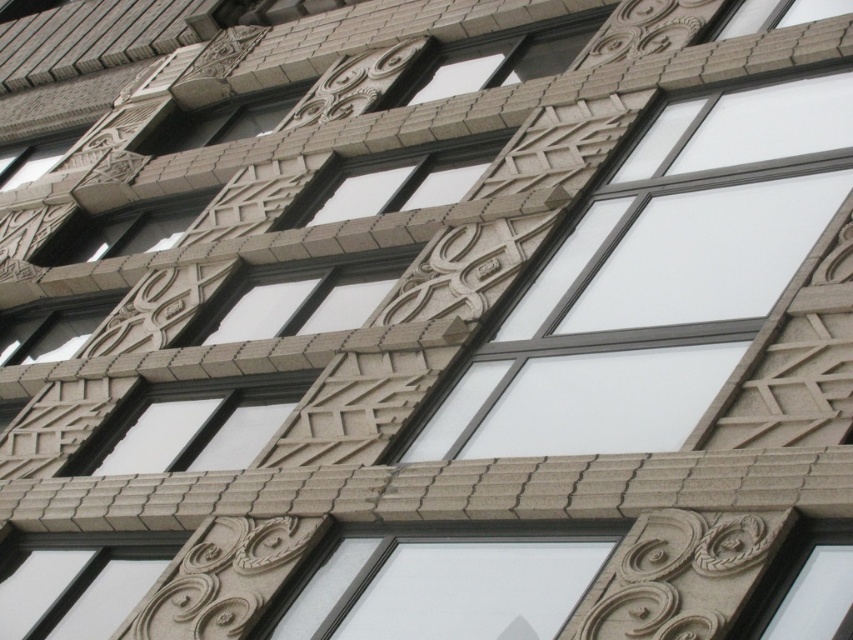
Question: Observing the image, what is the correct spatial positioning of smooth gray stone window at center in reference to clear glass window at upper left?

Choices:
 (A) below
 (B) above

Answer: (A)

Question: Which object is closer to the camera taking this photo?

Choices:
 (A) smooth gray stone window at center
 (B) clear glass window at upper left

Answer: (A)

Question: Which point appears farthest from the camera in this image?

Choices:
 (A) (351, 179)
 (B) (166, 460)
 (C) (35, 150)

Answer: (C)

Question: Does smooth gray stone window at center have a greater width compared to clear glass window at upper left?

Choices:
 (A) no
 (B) yes

Answer: (B)

Question: Does clear glass window at center come behind clear glass window at upper left?

Choices:
 (A) yes
 (B) no

Answer: (B)

Question: Which object is positioned closest to the clear glass window at upper left?

Choices:
 (A) clear glass window at center
 (B) smooth gray stone window at center

Answer: (B)